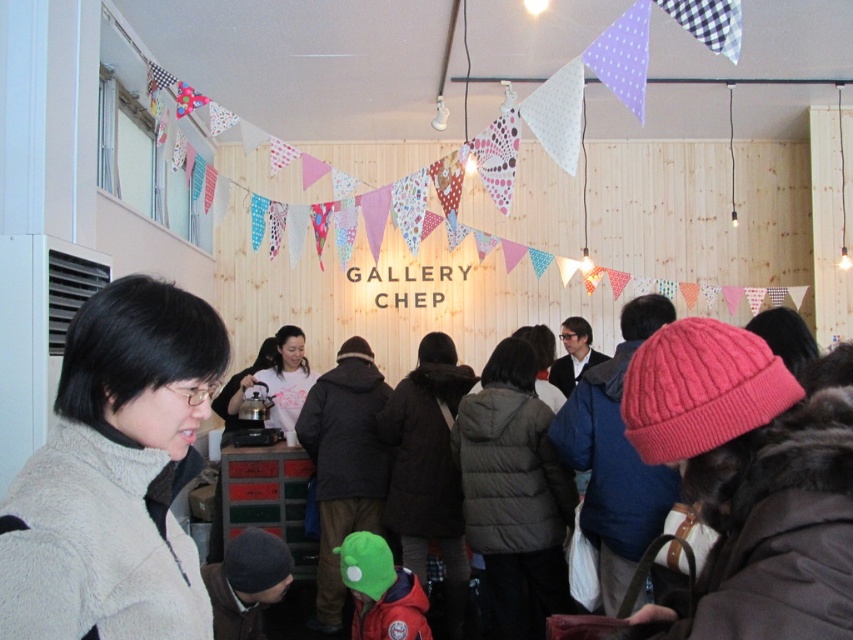
Between gray fleece jacket at lower left and white matte shirt at center, which one has more height?

white matte shirt at center is taller.

Does gray fleece jacket at lower left come in front of white matte shirt at center?

Yes, it is.

Between point (15, 628) and point (305, 356), which one is positioned in front?

Point (15, 628) is more forward.

The image size is (853, 640). Find the location of `gray fleece jacket at lower left`. gray fleece jacket at lower left is located at coordinates (115, 476).

Can you confirm if gray fleece jacket at lower left is positioned below dark brown fur coat at center?

Incorrect, gray fleece jacket at lower left is not positioned below dark brown fur coat at center.

Who is taller, gray fleece jacket at lower left or dark brown fur coat at center?

dark brown fur coat at center is taller.

Is point (70, 557) positioned after point (433, 516)?

No, (70, 557) is in front of (433, 516).

Image resolution: width=853 pixels, height=640 pixels. I want to click on gray fleece jacket at lower left, so click(x=115, y=476).

Who is more distant from viewer, (463, 506) or (256, 378)?

The point (256, 378) is behind.

Who is positioned more to the left, dark gray puffer jacket at center or white matte shirt at center?

Positioned to the left is white matte shirt at center.

This screenshot has width=853, height=640. In order to click on dark gray puffer jacket at center in this screenshot , I will do `click(514, 493)`.